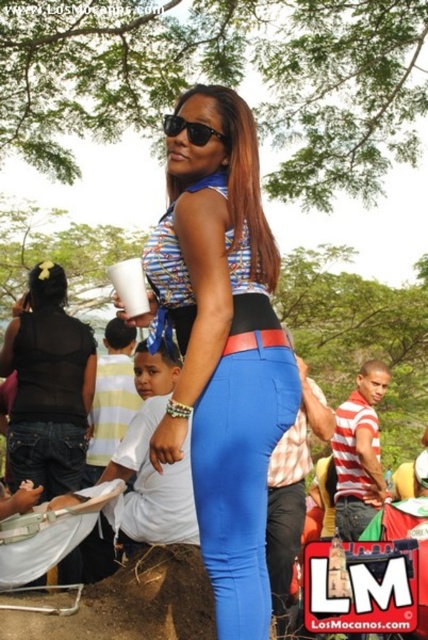
Question: Which object appears farthest from the camera in this image?

Choices:
 (A) black sheer top at upper left
 (B) brown dirt mound at lower left
 (C) blue smooth leggings at center

Answer: (A)

Question: Can you confirm if black sheer top at upper left is positioned above black plastic sunglasses at upper center?

Choices:
 (A) yes
 (B) no

Answer: (B)

Question: In this image, where is blue smooth leggings at center located relative to black plastic sunglasses at upper center?

Choices:
 (A) right
 (B) left

Answer: (A)

Question: Which object is farther from the camera taking this photo?

Choices:
 (A) brown dirt mound at lower left
 (B) black plastic sunglasses at upper center
 (C) black sheer top at upper left

Answer: (C)

Question: Estimate the real-world distances between objects in this image. Which object is farther from the black plastic sunglasses at upper center?

Choices:
 (A) blue matte pants at center
 (B) black sheer top at upper left
 (C) blue smooth leggings at center

Answer: (B)

Question: Does black sheer top at upper left lie behind black plastic sunglasses at upper center?

Choices:
 (A) yes
 (B) no

Answer: (A)